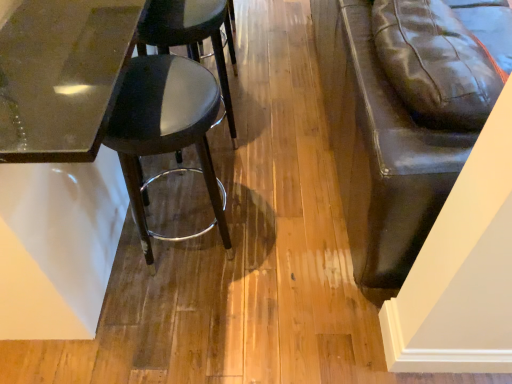
The height and width of the screenshot is (384, 512). What do you see at coordinates (166, 131) in the screenshot?
I see `matte black stool at left, the 2th stool from the top` at bounding box center [166, 131].

The width and height of the screenshot is (512, 384). Describe the element at coordinates (191, 36) in the screenshot. I see `black leather stool at center, the second stool from the bottom` at that location.

This screenshot has height=384, width=512. What are the coordinates of `glossy glass table at upper left` in the screenshot? It's located at (58, 161).

Locate an element on the screen. This screenshot has height=384, width=512. matte black stool at left, the 2th stool from the top is located at coordinates (166, 131).

Could you tell me if glossy glass table at upper left is facing matte black stool at left, the 2th stool from the top?

No.

Considering the sizes of glossy glass table at upper left and matte black stool at left, the 2th stool from the top, in the image, is glossy glass table at upper left bigger or smaller than matte black stool at left, the 2th stool from the top,?

In the image, glossy glass table at upper left appears to be larger than matte black stool at left, the 2th stool from the top.

Is point (42, 107) positioned after point (197, 112)?

That is False.

Considering the sizes of glossy glass table at upper left and matte black stool at left, the 2th stool from the top, in the image, is glossy glass table at upper left wider or thinner than matte black stool at left, the 2th stool from the top,?

Considering their sizes, glossy glass table at upper left looks broader than matte black stool at left, the 2th stool from the top.

From a real-world perspective, is matte black stool at left, the 2th stool from the top, positioned over black leather stool at center, positioned as the 1th stool in top-to-bottom order, based on gravity?

Yes, from a real-world perspective, matte black stool at left, the 2th stool from the top, is above black leather stool at center, positioned as the 1th stool in top-to-bottom order.

Between point (207, 93) and point (185, 3), which one is positioned behind?

Positioned behind is point (185, 3).

From the image's perspective, does matte black stool at left, which is the first stool from bottom to top, appear higher than black leather stool at center, positioned as the 1th stool in top-to-bottom order?

No.

In terms of size, does matte black stool at left, which is the first stool from bottom to top, appear bigger or smaller than black leather stool at center, the second stool from the bottom?

Considering their sizes, matte black stool at left, which is the first stool from bottom to top, takes up less space than black leather stool at center, the second stool from the bottom.

Is black leather stool at center, the second stool from the bottom, looking in the opposite direction of glossy glass table at upper left?

Yes, black leather stool at center, the second stool from the bottom, is positioned with its back facing glossy glass table at upper left.

From a real-world perspective, starting from the glossy glass table at upper left, which stool is the 2nd one below it? Please provide its 2D coordinates.

[(191, 36)]

Does black leather stool at center, the second stool from the bottom, appear on the left side of glossy glass table at upper left?

Incorrect, black leather stool at center, the second stool from the bottom, is not on the left side of glossy glass table at upper left.

Which is behind, black leather stool at center, positioned as the 1th stool in top-to-bottom order, or glossy glass table at upper left?

black leather stool at center, positioned as the 1th stool in top-to-bottom order.

Which is behind, point (166, 17) or point (152, 253)?

The point (152, 253) is farther.

Can you tell me how much black leather stool at center, positioned as the 1th stool in top-to-bottom order, and matte black stool at left, the 2th stool from the top, differ in facing direction?

5.27e-05 degrees separate the facing orientations of black leather stool at center, positioned as the 1th stool in top-to-bottom order, and matte black stool at left, the 2th stool from the top.

Is black leather stool at center, positioned as the 1th stool in top-to-bottom order, spatially inside matte black stool at left, which is the first stool from bottom to top, or outside of it?

black leather stool at center, positioned as the 1th stool in top-to-bottom order, exists outside the volume of matte black stool at left, which is the first stool from bottom to top.

The width and height of the screenshot is (512, 384). In order to click on stool above the black leather stool at center, positioned as the 1th stool in top-to-bottom order (from a real-world perspective) in this screenshot , I will do `click(166, 131)`.

From the image's perspective, between matte black stool at left, which is the first stool from bottom to top, and glossy glass table at upper left, who is located below?

matte black stool at left, which is the first stool from bottom to top, from the image's perspective.

Is matte black stool at left, which is the first stool from bottom to top, in front of or behind glossy glass table at upper left in the image?

matte black stool at left, which is the first stool from bottom to top, is positioned farther from the viewer than glossy glass table at upper left.

Consider the image. Would you say matte black stool at left, the 2th stool from the top, is inside or outside glossy glass table at upper left?

matte black stool at left, the 2th stool from the top, is enclosed within glossy glass table at upper left.

From a real-world perspective, is matte black stool at left, which is the first stool from bottom to top, physically located above or below glossy glass table at upper left?

From a real-world perspective, matte black stool at left, which is the first stool from bottom to top, is physically below glossy glass table at upper left.

Who is taller, glossy glass table at upper left or black leather stool at center, the second stool from the bottom?

glossy glass table at upper left is taller.

Considering the points (117, 53) and (148, 40), which point is behind, point (117, 53) or point (148, 40)?

Point (148, 40)

Are glossy glass table at upper left and black leather stool at center, the second stool from the bottom, located far from each other?

Actually, glossy glass table at upper left and black leather stool at center, the second stool from the bottom, are a little close together.

Could black leather stool at center, the second stool from the bottom, be considered to be inside glossy glass table at upper left?

Indeed, black leather stool at center, the second stool from the bottom, is located within glossy glass table at upper left.

You are a GUI agent. You are given a task and a screenshot of the screen. Output one action in this format:
    pyautogui.click(x=<x>, y=<y>)
    Task: Click on the table that is on the left side of matte black stool at left, which is the first stool from bottom to top
    The height and width of the screenshot is (384, 512).
    Given the screenshot: What is the action you would take?
    pyautogui.click(x=58, y=161)

I want to click on stool above the black leather stool at center, the second stool from the bottom (from a real-world perspective), so click(x=166, y=131).

Considering their positions, is matte black stool at left, the 2th stool from the top, positioned further to black leather stool at center, the second stool from the bottom, than glossy glass table at upper left?

glossy glass table at upper left is further to black leather stool at center, the second stool from the bottom.

From the image, which object appears to be farther from black leather stool at center, positioned as the 1th stool in top-to-bottom order, glossy glass table at upper left or matte black stool at left, the 2th stool from the top?

glossy glass table at upper left.

Considering their positions, is glossy glass table at upper left positioned further to matte black stool at left, the 2th stool from the top, than black leather stool at center, the second stool from the bottom?

black leather stool at center, the second stool from the bottom.

Based on their spatial positions, is matte black stool at left, the 2th stool from the top, or black leather stool at center, the second stool from the bottom, closer to glossy glass table at upper left?

matte black stool at left, the 2th stool from the top.

When comparing their distances from glossy glass table at upper left, does black leather stool at center, positioned as the 1th stool in top-to-bottom order, or matte black stool at left, which is the first stool from bottom to top, seem closer?

matte black stool at left, which is the first stool from bottom to top.

Looking at the image, which one is located further to matte black stool at left, which is the first stool from bottom to top, black leather stool at center, positioned as the 1th stool in top-to-bottom order, or glossy glass table at upper left?

black leather stool at center, positioned as the 1th stool in top-to-bottom order.

You are a GUI agent. You are given a task and a screenshot of the screen. Output one action in this format:
    pyautogui.click(x=<x>, y=<y>)
    Task: Click on the stool between glossy glass table at upper left and matte black stool at left, which is the first stool from bottom to top, in the vertical direction
    Image resolution: width=512 pixels, height=384 pixels.
    Given the screenshot: What is the action you would take?
    pyautogui.click(x=191, y=36)